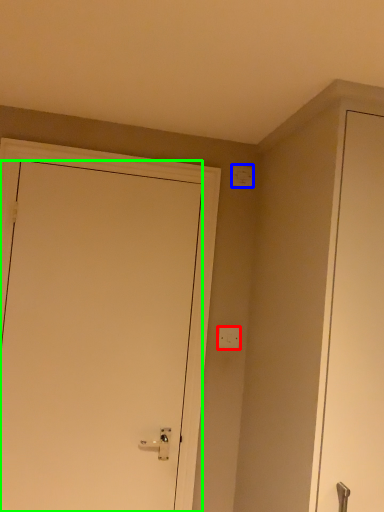
Question: Estimate the real-world distances between objects in this image. Which object is farther from light switch (highlighted by a red box), light switch (highlighted by a blue box) or door (highlighted by a green box)?

Choices:
 (A) light switch
 (B) door

Answer: (A)